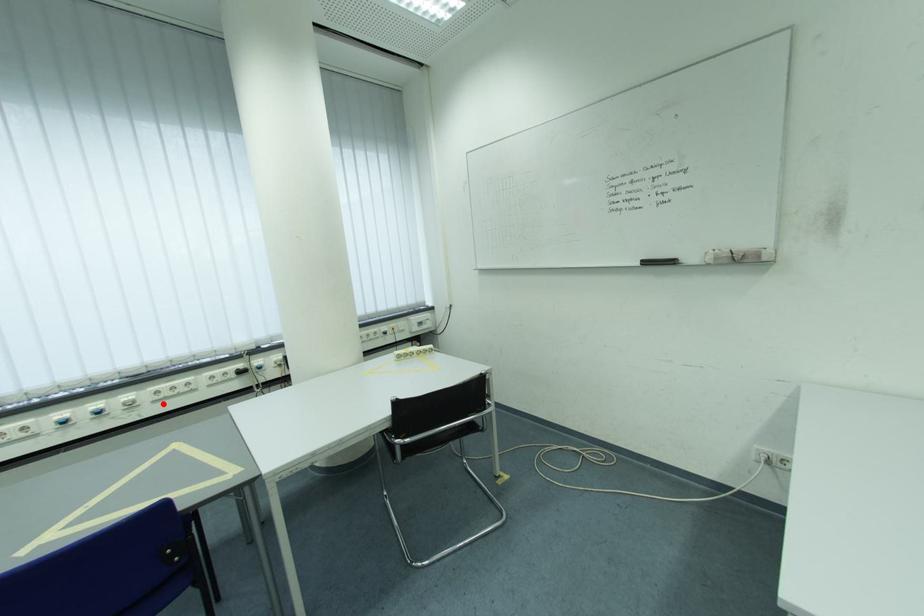
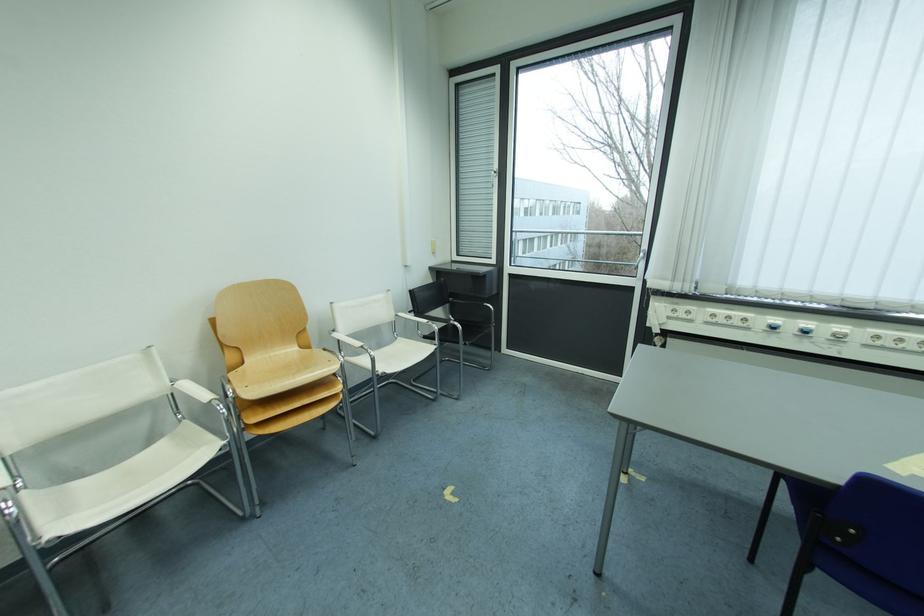
The point at the highlighted location is marked in the first image. Where is the corresponding point in the second image?

(874, 347)